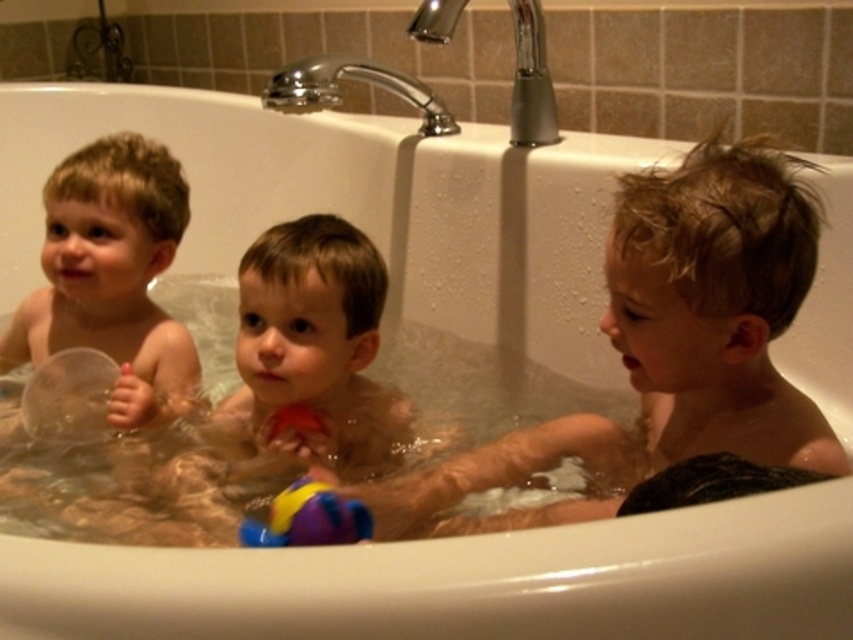
Which is behind, point (280, 372) or point (42, 305)?

The point (42, 305) is more distant.

Where is `smooth plastic ball at center`? The height and width of the screenshot is (640, 853). smooth plastic ball at center is located at coordinates (297, 372).

Find the location of a particular element. The width and height of the screenshot is (853, 640). smooth plastic ball at center is located at coordinates (297, 372).

Identify the location of smooth plastic ball at center. (297, 372).

Looking at this image, can you confirm if smooth plastic ball at center is wider than rubberized multicolored ball at lower center?

Correct, the width of smooth plastic ball at center exceeds that of rubberized multicolored ball at lower center.

Between smooth plastic ball at center and rubberized multicolored ball at lower center, which one is positioned lower?

rubberized multicolored ball at lower center is below.

Is point (376, 476) positioned behind point (283, 545)?

Yes, it is behind point (283, 545).

This screenshot has width=853, height=640. I want to click on smooth plastic ball at center, so [x=297, y=372].

Is point (480, 464) closer to camera compared to point (350, 372)?

That is True.

Between point (622, 209) and point (267, 372), which one is positioned in front?

Point (622, 209)

Where is `blonde hair boy at center`? blonde hair boy at center is located at coordinates (666, 346).